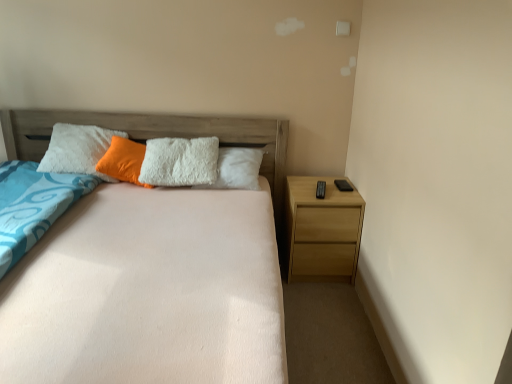
You are a GUI agent. You are given a task and a screenshot of the screen. Output one action in this format:
    pyautogui.click(x=<x>, y=<y>)
    Task: Click on the peach soft fabric bed at center
    The image size is (512, 384).
    Given the screenshot: What is the action you would take?
    pyautogui.click(x=152, y=269)

The image size is (512, 384). Describe the element at coordinates (322, 231) in the screenshot. I see `light brown wood nightstand at right` at that location.

Looking at this image, what is the approximate width of orange fuzzy pillow at center?

orange fuzzy pillow at center is 18.37 centimeters wide.

Locate an element on the screen. peach soft fabric bed at center is located at coordinates (152, 269).

Is light brown wood nightstand at right inside the boundaries of orange fuzzy pillow at center, or outside?

light brown wood nightstand at right is spatially situated outside orange fuzzy pillow at center.

Based on the photo, are light brown wood nightstand at right and orange fuzzy pillow at center located far from each other?

Yes, light brown wood nightstand at right and orange fuzzy pillow at center are located far from each other.

From the image's perspective, which object appears higher, light brown wood nightstand at right or orange fuzzy pillow at center?

From the image's view, orange fuzzy pillow at center is above.

Is point (300, 184) closer to camera compared to point (136, 164)?

No, it is behind (136, 164).

Who is smaller, peach soft fabric bed at center or orange fuzzy pillow at center?

Smaller between the two is orange fuzzy pillow at center.

Considering the relative sizes of peach soft fabric bed at center and orange fuzzy pillow at center in the image provided, is peach soft fabric bed at center wider than orange fuzzy pillow at center?

Yes, peach soft fabric bed at center is wider than orange fuzzy pillow at center.

Which point is more forward, (x=269, y=240) or (x=106, y=152)?

Positioned in front is point (x=269, y=240).

Locate an element on the screen. pillow behind the peach soft fabric bed at center is located at coordinates (123, 161).

From the image's perspective, who appears lower, light brown wood nightstand at right or peach soft fabric bed at center?

peach soft fabric bed at center is shown below in the image.

Are light brown wood nightstand at right and peach soft fabric bed at center beside each other?

light brown wood nightstand at right and peach soft fabric bed at center are not in contact.

Does light brown wood nightstand at right appear on the right side of peach soft fabric bed at center?

Correct, you'll find light brown wood nightstand at right to the right of peach soft fabric bed at center.

Is orange fuzzy pillow at center in contact with light brown wood nightstand at right?

No, orange fuzzy pillow at center is not in contact with light brown wood nightstand at right.

Which of these two, orange fuzzy pillow at center or light brown wood nightstand at right, is thinner?

orange fuzzy pillow at center.

In the image, is orange fuzzy pillow at center positioned in front of or behind light brown wood nightstand at right?

orange fuzzy pillow at center is in front of light brown wood nightstand at right.

Is orange fuzzy pillow at center taller or shorter than light brown wood nightstand at right?

In the image, orange fuzzy pillow at center appears to be shorter than light brown wood nightstand at right.

This screenshot has height=384, width=512. In order to click on pillow that appears above the peach soft fabric bed at center (from the image's perspective) in this screenshot , I will do `click(123, 161)`.

Considering the positions of points (115, 150) and (59, 266), is point (115, 150) farther from camera compared to point (59, 266)?

Yes.

What's the angular difference between orange fuzzy pillow at center and peach soft fabric bed at center's facing directions?

The angle between the facing direction of orange fuzzy pillow at center and the facing direction of peach soft fabric bed at center is 54.3 degrees.

Is peach soft fabric bed at center behind light brown wood nightstand at right?

No, peach soft fabric bed at center is closer to the camera.

Does peach soft fabric bed at center have a greater width compared to light brown wood nightstand at right?

Indeed, peach soft fabric bed at center has a greater width compared to light brown wood nightstand at right.

From the image's perspective, is peach soft fabric bed at center located above or below light brown wood nightstand at right?

peach soft fabric bed at center is situated lower than light brown wood nightstand at right in the image.

Find the location of a particular element. nightstand on the right of orange fuzzy pillow at center is located at coordinates (322, 231).

This screenshot has width=512, height=384. Identify the location of pillow behind the peach soft fabric bed at center. (123, 161).

Estimate the real-world distances between objects in this image. Which object is closer to peach soft fabric bed at center, light brown wood nightstand at right or orange fuzzy pillow at center?

Among the two, light brown wood nightstand at right is located nearer to peach soft fabric bed at center.

When comparing their distances from light brown wood nightstand at right, does orange fuzzy pillow at center or peach soft fabric bed at center seem further?

orange fuzzy pillow at center is positioned further to the anchor light brown wood nightstand at right.

From the image, which object appears to be nearer to orange fuzzy pillow at center, light brown wood nightstand at right or peach soft fabric bed at center?

peach soft fabric bed at center.

Based on their spatial positions, is peach soft fabric bed at center or orange fuzzy pillow at center closer to light brown wood nightstand at right?

peach soft fabric bed at center is positioned closer to the anchor light brown wood nightstand at right.

Which object lies nearer to the anchor point orange fuzzy pillow at center, peach soft fabric bed at center or light brown wood nightstand at right?

The object closer to orange fuzzy pillow at center is peach soft fabric bed at center.

Which object lies nearer to the anchor point peach soft fabric bed at center, orange fuzzy pillow at center or light brown wood nightstand at right?

Based on the image, light brown wood nightstand at right appears to be nearer to peach soft fabric bed at center.

Locate an element on the screen. pillow between peach soft fabric bed at center and light brown wood nightstand at right in the front-back direction is located at coordinates (123, 161).